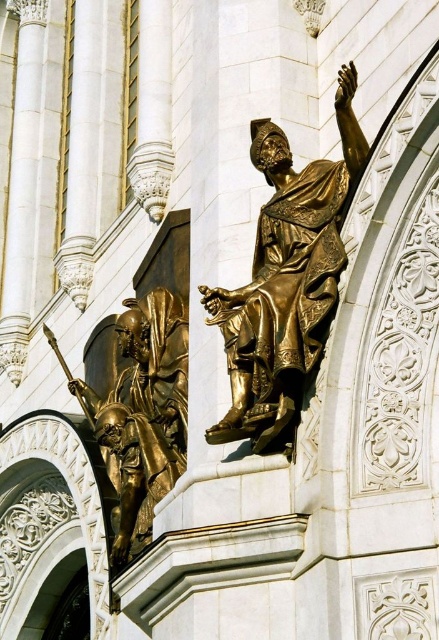
You are an architect examining the facade of this grand structure. You notice a specific coordinate point at (285,280) on the facade. Based on the image, what object is located at this coordinate?

The point at (285,280) corresponds to the shiny gold statue at center.